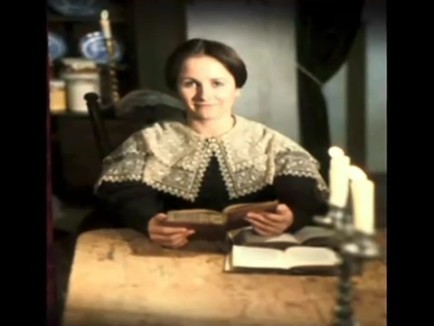
At what (x,y) coordinates should I click in order to perform the action: click on candle. Please return your answer as a coordinate pair (x, y). The width and height of the screenshot is (434, 326). Looking at the image, I should click on pos(105,26).